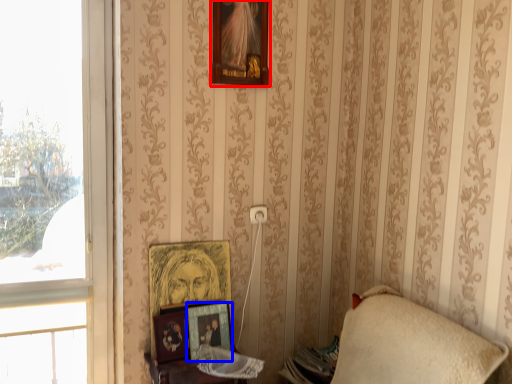
Question: Which point is further to the camera, picture frame (highlighted by a red box) or picture frame (highlighted by a blue box)?

Choices:
 (A) picture frame
 (B) picture frame

Answer: (B)